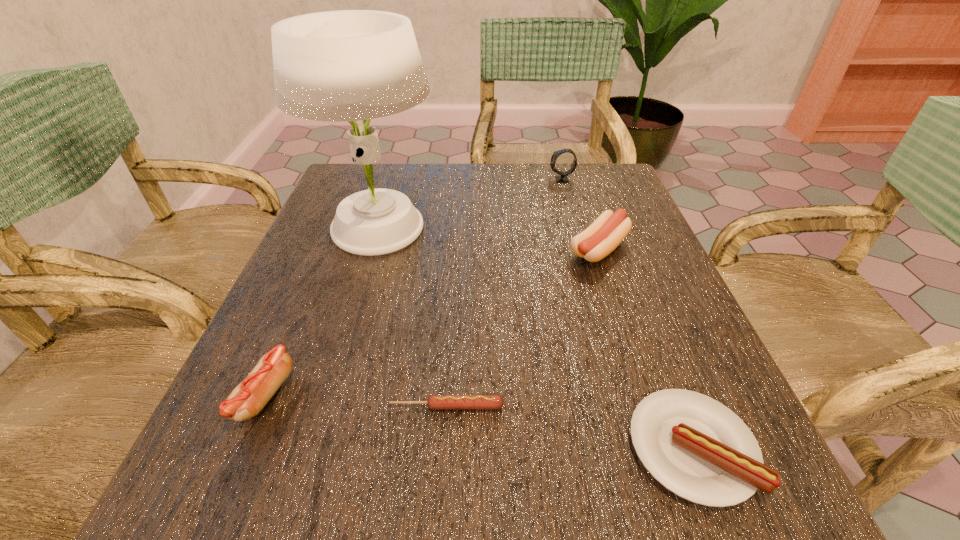
Find the location of `vacant space that satisfies the following two spatial constraints: 1. on the face of the farthest object; 2. on the front side of the leftmost sausage`. vacant space that satisfies the following two spatial constraints: 1. on the face of the farthest object; 2. on the front side of the leftmost sausage is located at coordinates (623, 396).